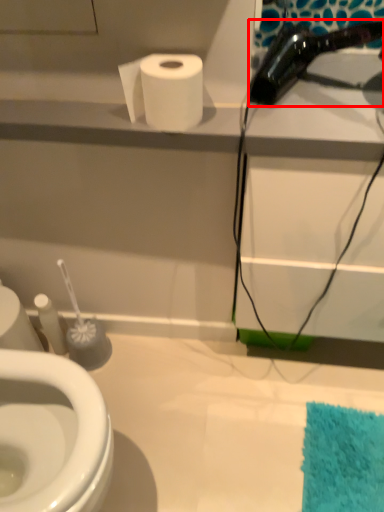
Question: From the image's perspective, what is the correct spatial positioning of hair drier (annotated by the red box) in reference to toilet paper?

Choices:
 (A) below
 (B) above

Answer: (B)